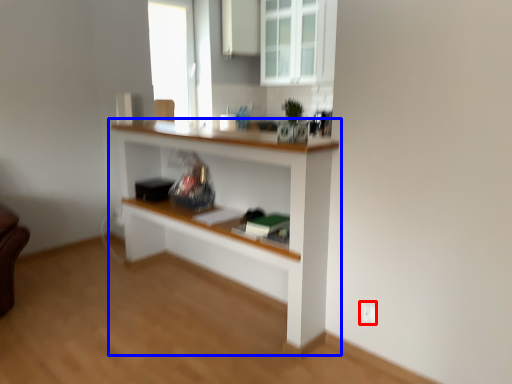
Question: Among these objects, which one is farthest to the camera, electric outlet (highlighted by a red box) or shelf (highlighted by a blue box)?

Choices:
 (A) electric outlet
 (B) shelf

Answer: (A)